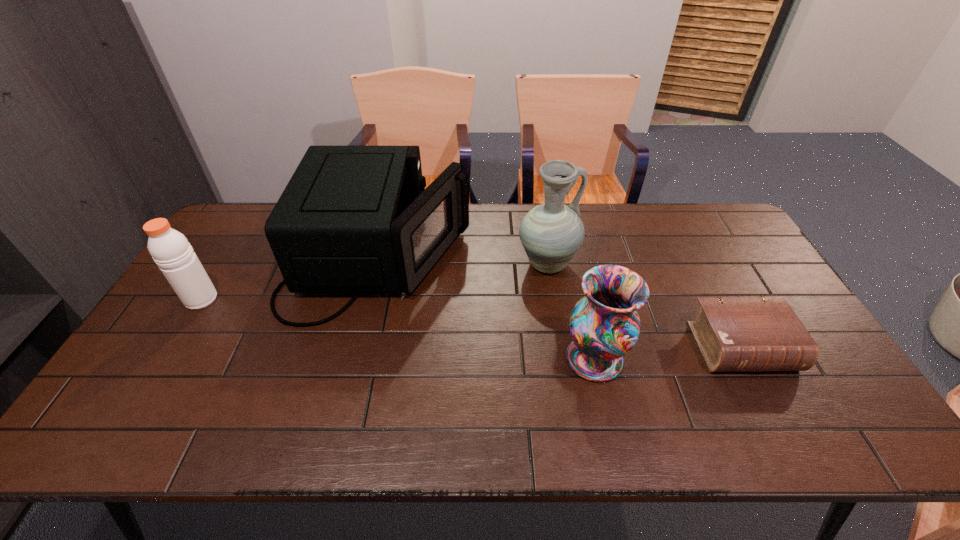
Locate an element on the screen. This screenshot has height=540, width=960. free space located 0.070m on the spine side of the Bible is located at coordinates (771, 403).

You are a GUI agent. You are given a task and a screenshot of the screen. Output one action in this format:
    pyautogui.click(x=<x>, y=<y>)
    Task: Click on the pitcher that is positioned at the far edge
    Image resolution: width=960 pixels, height=540 pixels.
    Given the screenshot: What is the action you would take?
    pyautogui.click(x=551, y=233)

The width and height of the screenshot is (960, 540). What are the coordinates of `microwave oven present at the far edge` in the screenshot? It's located at (352, 219).

At what (x,y) coordinates should I click in order to perform the action: click on object that is at the left edge. Please return your answer as a coordinate pair (x, y). This screenshot has width=960, height=540. Looking at the image, I should click on (173, 254).

Locate an element on the screen. The height and width of the screenshot is (540, 960). object at the right edge is located at coordinates (734, 334).

This screenshot has height=540, width=960. What are the coordinates of `vacant region at the far edge of the desktop` in the screenshot? It's located at (506, 209).

This screenshot has height=540, width=960. Identify the location of vacant region at the near edge. (529, 434).

You are a GUI agent. You are given a task and a screenshot of the screen. Output one action in this format:
    pyautogui.click(x=<x>, y=<y>)
    Task: Click on the vacant space at the left edge of the desktop
    This screenshot has width=960, height=540.
    Given the screenshot: What is the action you would take?
    pyautogui.click(x=214, y=283)

In the image, there is a desktop. Identify the location of vacant region at the right edge. (837, 382).

Where is `free space between the tallest object and the shortest object`? This screenshot has width=960, height=540. free space between the tallest object and the shortest object is located at coordinates (644, 306).